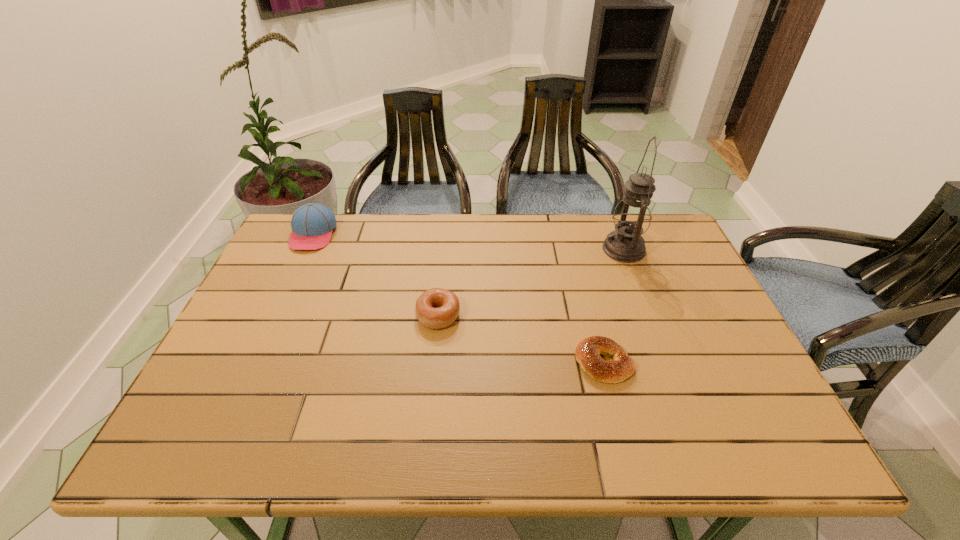
The width and height of the screenshot is (960, 540). Identify the location of empty space between the oil lamp and the farther bagel. (531, 282).

At what (x,y) coordinates should I click in order to perform the action: click on empty location between the second object from left to right and the third shortest object. Please return your answer as a coordinate pair (x, y). This screenshot has width=960, height=540. Looking at the image, I should click on (375, 274).

This screenshot has height=540, width=960. I want to click on free area in between the oil lamp and the nearest object, so click(613, 306).

The width and height of the screenshot is (960, 540). Identify the location of object that is the third closest to the right bagel. (312, 224).

Where is `the closest object to the nearer bagel`? This screenshot has height=540, width=960. the closest object to the nearer bagel is located at coordinates (436, 308).

Identify the location of free spot that satisfies the following two spatial constraints: 1. on the front side of the right bagel; 2. on the right side of the third tallest object. (433, 363).

I want to click on free space that satisfies the following two spatial constraints: 1. on the front-facing side of the second tallest object; 2. on the right side of the taller bagel, so click(x=276, y=315).

The height and width of the screenshot is (540, 960). I want to click on free location that satisfies the following two spatial constraints: 1. on the front-facing side of the farther bagel; 2. on the left side of the baseball cap, so click(276, 315).